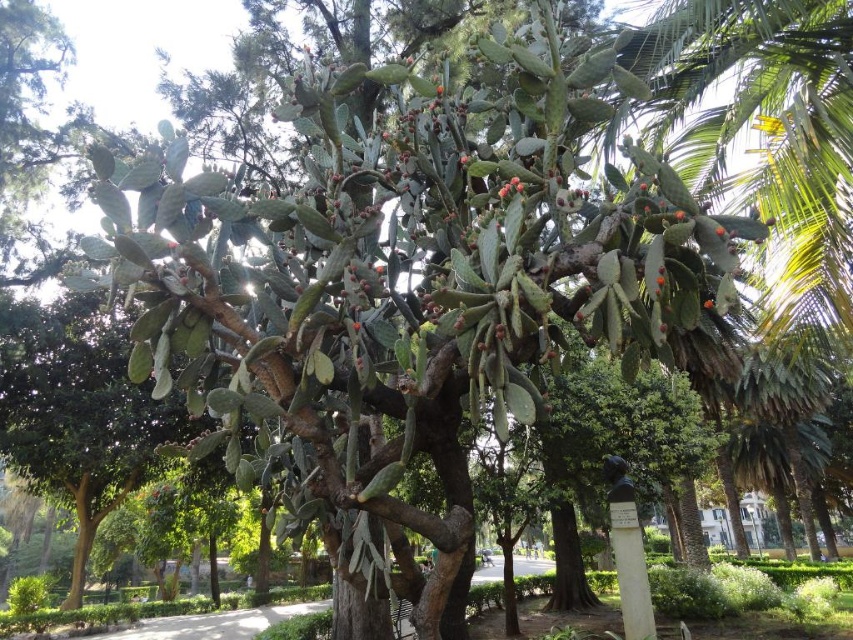
Which of these two, green leafy palm tree at right or red matte cactus at center, stands taller?

With more height is green leafy palm tree at right.

Does green leafy palm tree at right have a larger size compared to red matte cactus at center?

Indeed, green leafy palm tree at right has a larger size compared to red matte cactus at center.

The width and height of the screenshot is (853, 640). Identify the location of green leafy palm tree at right. (782, 429).